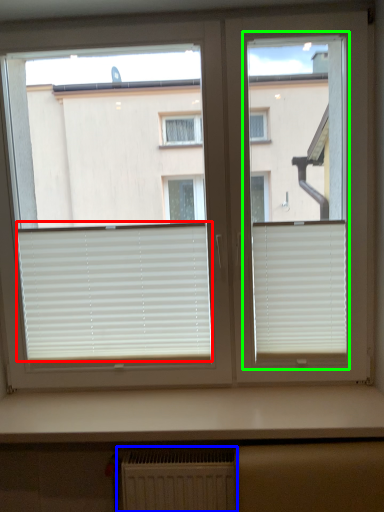
Question: Which is farther away from window blind (highlighted by a red box)? radiator (highlighted by a blue box) or screen door (highlighted by a green box)?

Choices:
 (A) radiator
 (B) screen door

Answer: (B)